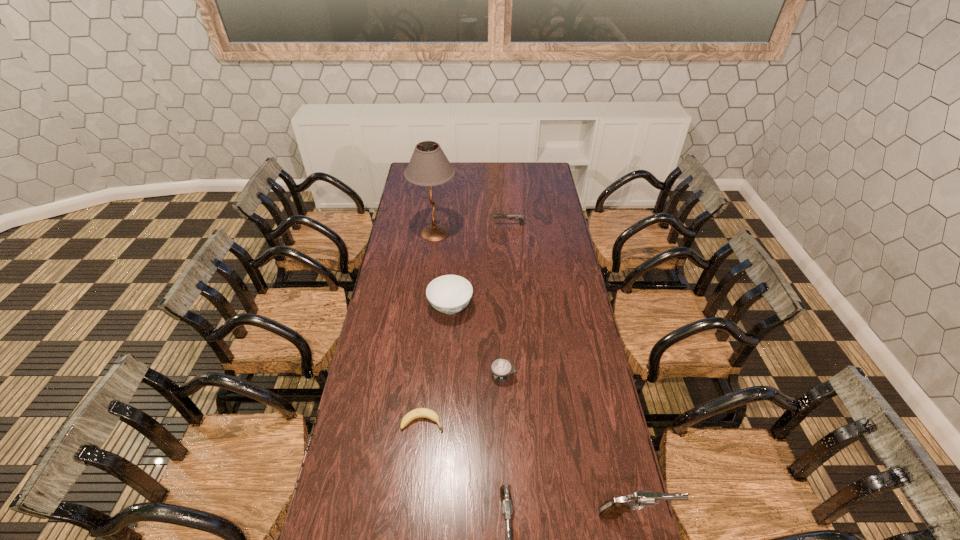
This screenshot has width=960, height=540. I want to click on free area in between the gun and the chinaware, so click(480, 266).

Where is `free space between the tallest object and the gun`? The height and width of the screenshot is (540, 960). free space between the tallest object and the gun is located at coordinates (472, 229).

Locate an element on the screen. blank region between the fifth tallest object and the sixth tallest object is located at coordinates (506, 300).

Find the location of `free space between the table lamp and the yogurt`. free space between the table lamp and the yogurt is located at coordinates (468, 303).

Where is `object that ranks as the fifth closest to the third nearest object`? object that ranks as the fifth closest to the third nearest object is located at coordinates (429, 166).

Identify which object is the fourth closest to the shorter pistol. Please provide its 2D coordinates. Your answer should be formatted as a tuple, i.e. [(x, y)], where the tuple contains the x and y coordinates of a point satisfying the conditions above.

[(449, 294)]

Find the location of a particular element. The image size is (960, 540). free space that satisfies the following two spatial constraints: 1. on the back side of the sixth tallest object; 2. on the front-facing side of the tallest object is located at coordinates (496, 233).

Where is `free space that satisfies the following two spatial constraints: 1. on the front-facing side of the tallest object; 2. on the back side of the chinaware`? Image resolution: width=960 pixels, height=540 pixels. free space that satisfies the following two spatial constraints: 1. on the front-facing side of the tallest object; 2. on the back side of the chinaware is located at coordinates (426, 307).

Locate an element on the screen. vacant area that satisfies the following two spatial constraints: 1. on the front-facing side of the tallest object; 2. on the back side of the fifth nearest object is located at coordinates (426, 307).